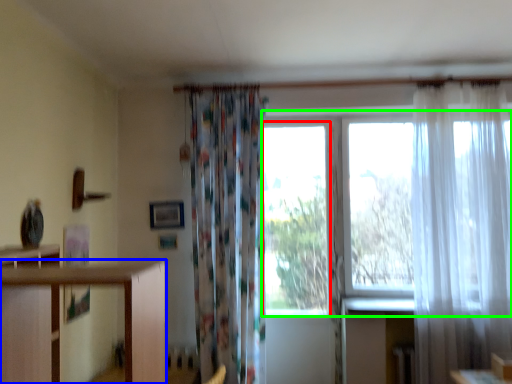
Question: Which object is the farthest from window (highlighted by a red box)? Choose among these: furniture (highlighted by a blue box) or window screen (highlighted by a green box).

Choices:
 (A) furniture
 (B) window screen

Answer: (A)